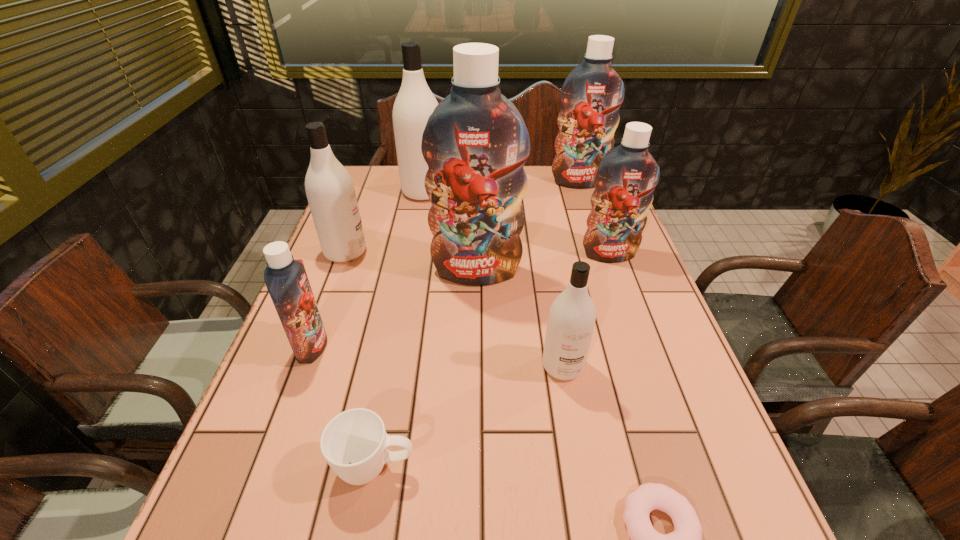
Where is `the fifth shampoo from left to right`? This screenshot has width=960, height=540. the fifth shampoo from left to right is located at coordinates click(x=572, y=315).

At what (x,y) coordinates should I click in order to perform the action: click on the rightmost white shampoo. Please return your answer as a coordinate pair (x, y). Looking at the image, I should click on (572, 315).

The height and width of the screenshot is (540, 960). Identify the location of cup. (354, 443).

Find the location of a particular element. free location located 0.090m on the front label of the tallest shampoo is located at coordinates (476, 313).

Find the location of a particular element. free space located 0.130m on the front-facing side of the second white shampoo from left to right is located at coordinates click(x=486, y=192).

Locate an element on the screen. Image resolution: width=960 pixels, height=540 pixels. blank area located on the front label of the third smallest blue shampoo is located at coordinates (594, 229).

Locate an element on the screen. This screenshot has width=960, height=540. vacant space situated on the front-facing side of the leftmost white shampoo is located at coordinates (428, 252).

Identify the location of vacant space situated 0.240m on the front label of the second smallest blue shampoo. Image resolution: width=960 pixels, height=540 pixels. click(x=636, y=330).

Where is `vacant space located 0.250m on the front label of the leftmost blue shampoo`? vacant space located 0.250m on the front label of the leftmost blue shampoo is located at coordinates (441, 346).

Locate an element on the screen. vacant point located on the front-facing side of the fourth object from right to left is located at coordinates (586, 495).